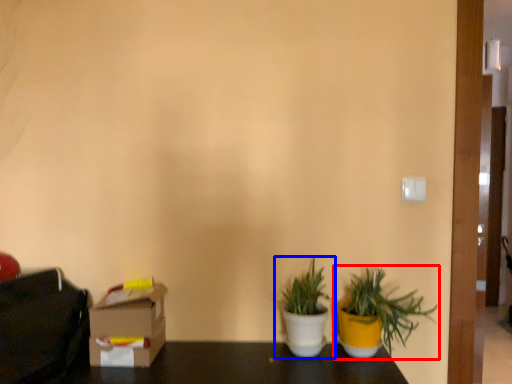
Question: Which point is further to the camera, houseplant (highlighted by a red box) or houseplant (highlighted by a blue box)?

Choices:
 (A) houseplant
 (B) houseplant

Answer: (B)